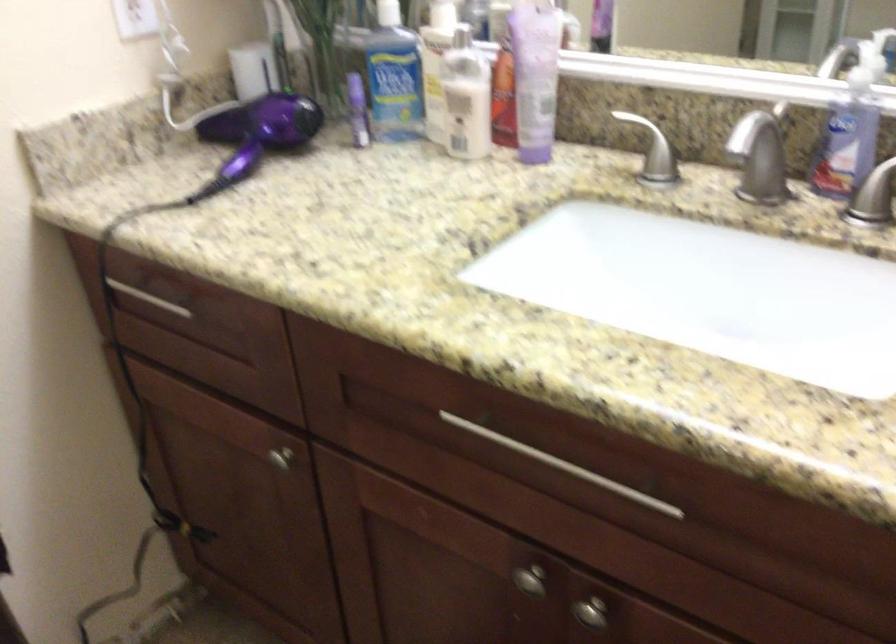
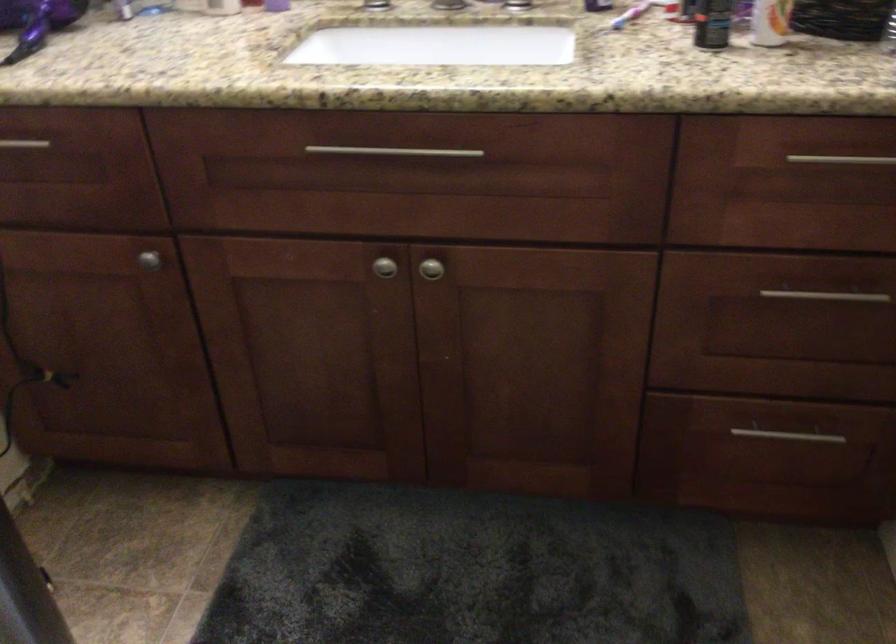
Find the pixel in the second image that matches point 272,453 in the first image.

(149, 259)